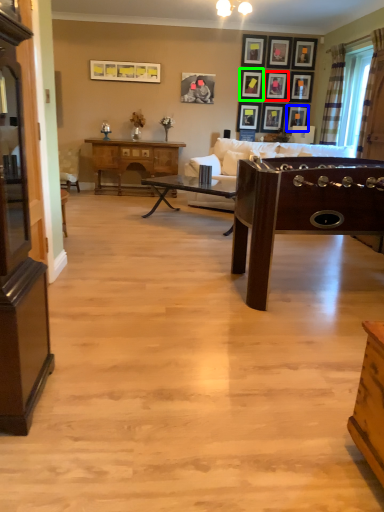
Question: Which object is the farthest from picture frame (highlighted by a red box)? Choose among these: picture frame (highlighted by a blue box) or picture frame (highlighted by a green box).

Choices:
 (A) picture frame
 (B) picture frame

Answer: (A)